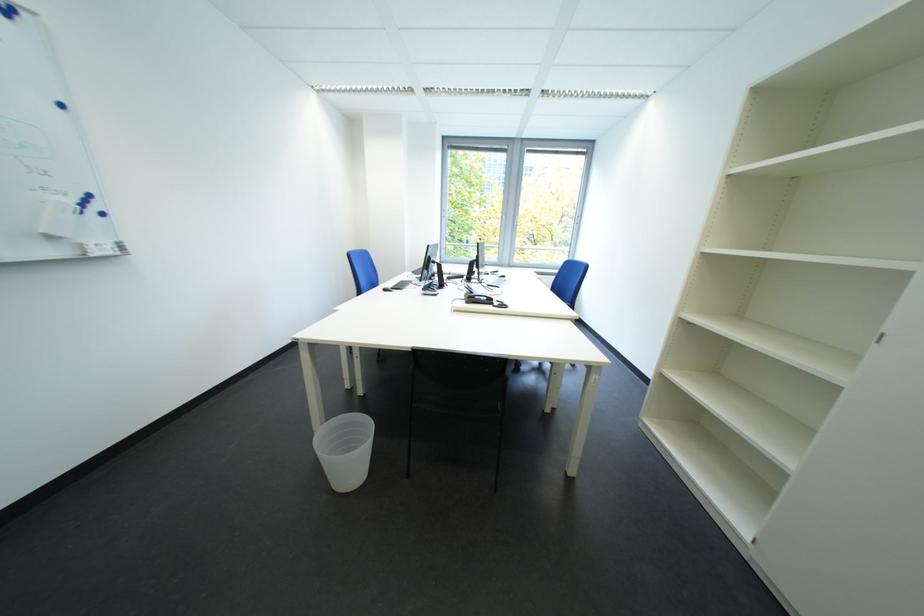
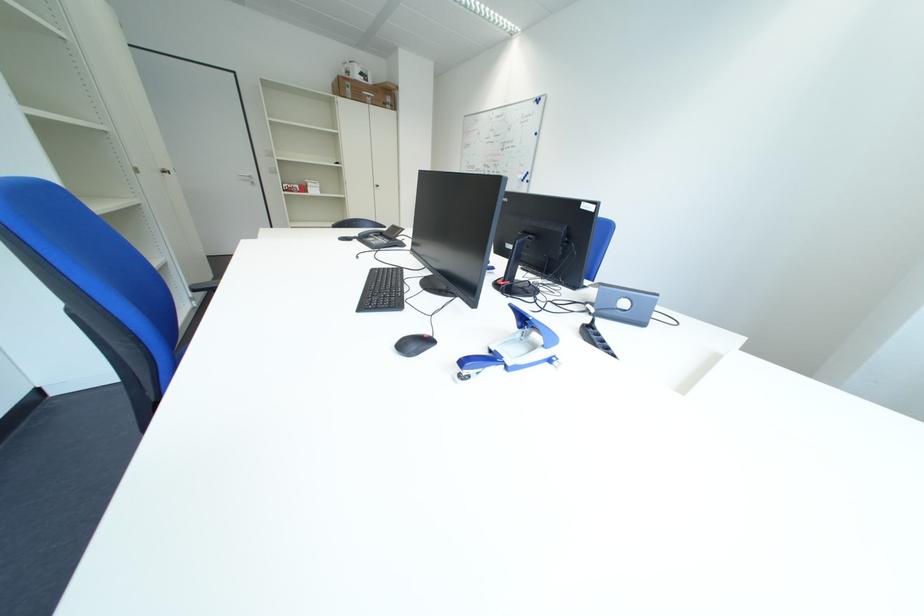
Question: I am providing you with two images of the same scene from different viewpoints. Please identify which objects are invisible in image2.

Choices:
 (A) silver door handle
 (B) computer keyboard
 (C) black chair armrest
 (D) red bottle

Answer: (B)